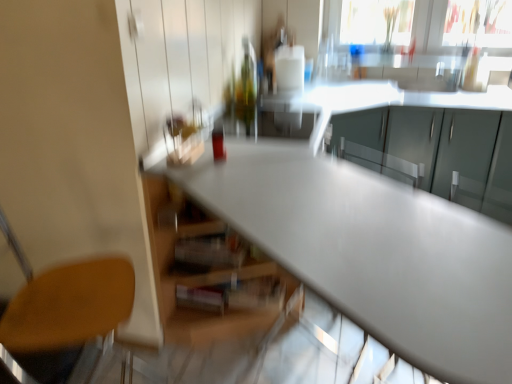
What is the approximate width of satin white table at center?

The width of satin white table at center is 23.54 inches.

In order to face transparent glass window screen at upper right, should I rotate leftwards or rightwards?

You should rotate right by 26.695 degrees.

Locate an element on the screen. The height and width of the screenshot is (384, 512). matte gray cabinets at upper right is located at coordinates (382, 100).

At what (x,y) coordinates should I click in order to perform the action: click on wooden seat at lower left. Please return your answer as a coordinate pair (x, y). This screenshot has width=512, height=384. Looking at the image, I should click on (69, 305).

Considering the sizes of objects wooden seat at lower left and matte gray cabinets at upper right in the image provided, who is thinner, wooden seat at lower left or matte gray cabinets at upper right?

wooden seat at lower left is thinner.

Based on their positions, is wooden seat at lower left located to the left or right of matte gray cabinets at upper right?

Based on their positions, wooden seat at lower left is located to the left of matte gray cabinets at upper right.

From a real-world perspective, is wooden seat at lower left over matte gray cabinets at upper right?

Yes.

From the image's perspective, is wooden seat at lower left below matte gray cabinets at upper right?

Yes, from the image's perspective, wooden seat at lower left is beneath matte gray cabinets at upper right.

The height and width of the screenshot is (384, 512). Identify the location of cabinetry above the wooden seat at lower left (from the image's perspective). (382, 100).

Is wooden seat at lower left a part of matte gray cabinets at upper right?

No, wooden seat at lower left is not surrounded by matte gray cabinets at upper right.

Is matte gray cabinets at upper right closer to camera compared to wooden seat at lower left?

No, matte gray cabinets at upper right is further to the viewer.

From a real-world perspective, which is physically above, matte gray cabinets at upper right or wooden seat at lower left?

In real-world perspective, wooden seat at lower left is above.

From a real-world perspective, is wooden seat at lower left positioned above or below transparent glass window screen at upper right?

From a real-world perspective, wooden seat at lower left is physically below transparent glass window screen at upper right.

Find the location of `window screen above the wooden seat at lower left (from a real-world perspective)`. window screen above the wooden seat at lower left (from a real-world perspective) is located at coordinates (478, 23).

Does wooden seat at lower left turn towards transparent glass window screen at upper right?

No, wooden seat at lower left is not turned towards transparent glass window screen at upper right.

Can you confirm if wooden seat at lower left is wider than transparent glass window screen at upper right?

Correct, the width of wooden seat at lower left exceeds that of transparent glass window screen at upper right.

Is transparent glass window screen at upper right surrounded by satin white table at center?

No, satin white table at center does not contain transparent glass window screen at upper right.

Can you confirm if satin white table at center is smaller than transparent glass window screen at upper right?

Incorrect, satin white table at center is not smaller in size than transparent glass window screen at upper right.

From a real-world perspective, who is located higher, satin white table at center or transparent glass window screen at upper right?

transparent glass window screen at upper right is physically above.

Can you see satin white table at center touching transparent glass window screen at upper right?

No, satin white table at center is not making contact with transparent glass window screen at upper right.

Is transparent glass window screen at upper right thinner than wooden seat at lower left?

Yes, transparent glass window screen at upper right is thinner than wooden seat at lower left.

Can you confirm if transparent glass window screen at upper right is smaller than wooden seat at lower left?

Correct, transparent glass window screen at upper right occupies less space than wooden seat at lower left.

Considering the positions of objects transparent glass window screen at upper right and wooden seat at lower left in the image provided, who is more to the left, transparent glass window screen at upper right or wooden seat at lower left?

wooden seat at lower left is more to the left.

Is transparent glass window screen at upper right not inside wooden seat at lower left?

transparent glass window screen at upper right lies outside wooden seat at lower left's area.

Is satin white table at center turned away from wooden seat at lower left?

Yes, wooden seat at lower left is at the back of satin white table at center.

From a real-world perspective, which is physically below, satin white table at center or wooden seat at lower left?

In real-world perspective, satin white table at center is lower.

The height and width of the screenshot is (384, 512). In order to click on table lying on the right of wooden seat at lower left in this screenshot , I will do `click(372, 251)`.

Is there a large distance between satin white table at center and wooden seat at lower left?

They are positioned close to each other.

Does transparent glass window screen at upper right appear on the right side of matte gray cabinets at upper right?

Indeed, transparent glass window screen at upper right is positioned on the right side of matte gray cabinets at upper right.

At what (x,y) coordinates should I click in order to perform the action: click on window screen behind the matte gray cabinets at upper right. Please return your answer as a coordinate pair (x, y). Looking at the image, I should click on (478, 23).

From the image's perspective, is transparent glass window screen at upper right above or below matte gray cabinets at upper right?

transparent glass window screen at upper right is situated higher than matte gray cabinets at upper right in the image.

Find the location of `chair that is on the left side of matte gray cabinets at upper right`. chair that is on the left side of matte gray cabinets at upper right is located at coordinates (69, 305).

Identify the location of chair that appears above the matte gray cabinets at upper right (from a real-world perspective). (69, 305).

Estimate the real-world distances between objects in this image. Which object is further from matte gray cabinets at upper right, transparent glass window screen at upper right or wooden seat at lower left?

Among the two, wooden seat at lower left is located further to matte gray cabinets at upper right.

Based on their spatial positions, is transparent glass window screen at upper right or satin white table at center closer to matte gray cabinets at upper right?

transparent glass window screen at upper right is closer to matte gray cabinets at upper right.

Which object lies nearer to the anchor point satin white table at center, matte gray cabinets at upper right or wooden seat at lower left?

The object closer to satin white table at center is wooden seat at lower left.

Estimate the real-world distances between objects in this image. Which object is closer to wooden seat at lower left, matte gray cabinets at upper right or transparent glass window screen at upper right?

Based on the image, matte gray cabinets at upper right appears to be nearer to wooden seat at lower left.

From the image, which object appears to be farther from transparent glass window screen at upper right, wooden seat at lower left or satin white table at center?

Based on the image, wooden seat at lower left appears to be further to transparent glass window screen at upper right.

Considering their positions, is transparent glass window screen at upper right positioned further to wooden seat at lower left than matte gray cabinets at upper right?

Among the two, transparent glass window screen at upper right is located further to wooden seat at lower left.

Looking at the image, which one is located further to wooden seat at lower left, transparent glass window screen at upper right or satin white table at center?

transparent glass window screen at upper right.

Considering their positions, is matte gray cabinets at upper right positioned closer to satin white table at center than transparent glass window screen at upper right?

The object closer to satin white table at center is matte gray cabinets at upper right.

Where is `table between wooden seat at lower left and matte gray cabinets at upper right from left to right`? This screenshot has height=384, width=512. table between wooden seat at lower left and matte gray cabinets at upper right from left to right is located at coordinates click(x=372, y=251).

This screenshot has width=512, height=384. In order to click on cabinetry positioned between satin white table at center and transparent glass window screen at upper right from near to far in this screenshot , I will do `click(382, 100)`.

I want to click on chair between satin white table at center and transparent glass window screen at upper right along the z-axis, so click(x=69, y=305).

Identify the location of cabinetry between wooden seat at lower left and transparent glass window screen at upper right. Image resolution: width=512 pixels, height=384 pixels. (382, 100).